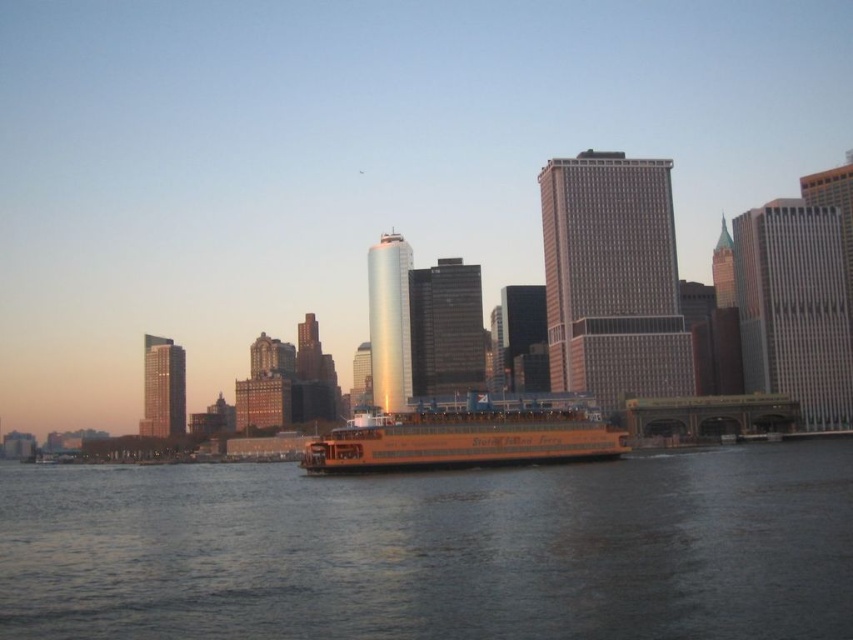
Question: Is brown water at center closer to the viewer compared to yellow matte ferry at center?

Choices:
 (A) yes
 (B) no

Answer: (A)

Question: Can you confirm if brown water at center is positioned above yellow matte ferry at center?

Choices:
 (A) yes
 (B) no

Answer: (B)

Question: Among these objects, which one is farthest from the camera?

Choices:
 (A) yellow matte ferry at center
 (B) brown water at center

Answer: (A)

Question: Which point appears closest to the camera in this image?

Choices:
 (A) (508, 426)
 (B) (503, 621)

Answer: (B)

Question: Can you confirm if brown water at center is positioned below yellow matte ferry at center?

Choices:
 (A) yes
 (B) no

Answer: (A)